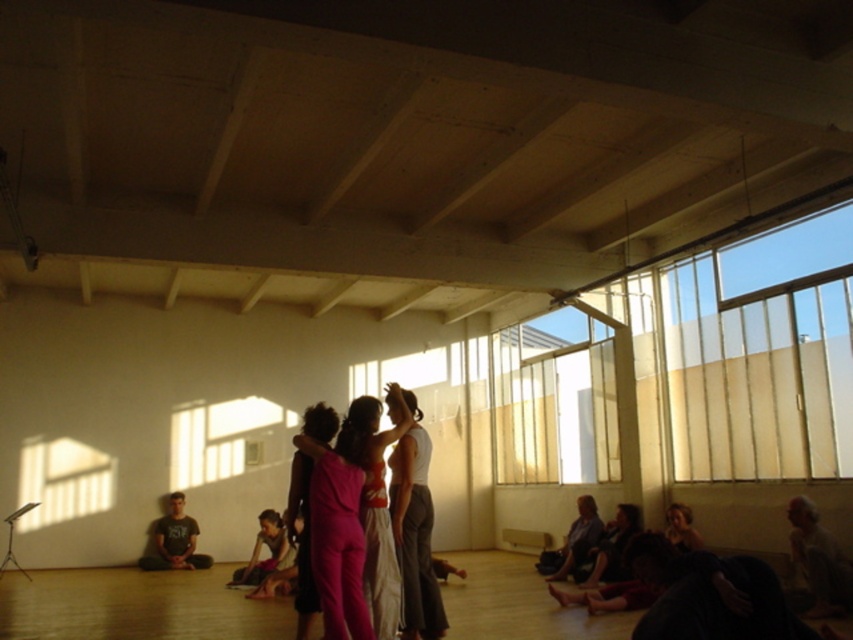
Does white matte tank top at center have a greater height compared to smooth brown hair at lower right?

Yes, white matte tank top at center is taller than smooth brown hair at lower right.

Does point (393, 524) come behind point (688, 541)?

No, it is not.

Which is in front, point (422, 611) or point (689, 547)?

Positioned in front is point (422, 611).

Identify the location of white matte tank top at center. (415, 529).

From the picture: Is dark gray t-shirt at lower left positioned before dark purple fabric at lower right?

No, it is behind dark purple fabric at lower right.

Is dark gray t-shirt at lower left bigger than dark purple fabric at lower right?

Incorrect, dark gray t-shirt at lower left is not larger than dark purple fabric at lower right.

Locate an element on the screen. This screenshot has height=640, width=853. dark gray t-shirt at lower left is located at coordinates (173, 540).

At what (x,y) coordinates should I click in order to perform the action: click on dark gray t-shirt at lower left. Please return your answer as a coordinate pair (x, y). Image resolution: width=853 pixels, height=640 pixels. Looking at the image, I should click on (173, 540).

Is transparent glass window at upper center below pink fabric dress at center?

Incorrect, transparent glass window at upper center is not positioned below pink fabric dress at center.

Between transparent glass window at upper center and pink fabric dress at center, which one has more height?

With more height is transparent glass window at upper center.

Where is `transparent glass window at upper center`? This screenshot has height=640, width=853. transparent glass window at upper center is located at coordinates (556, 400).

Find the location of `transparent glass window at upper center`. transparent glass window at upper center is located at coordinates (556, 400).